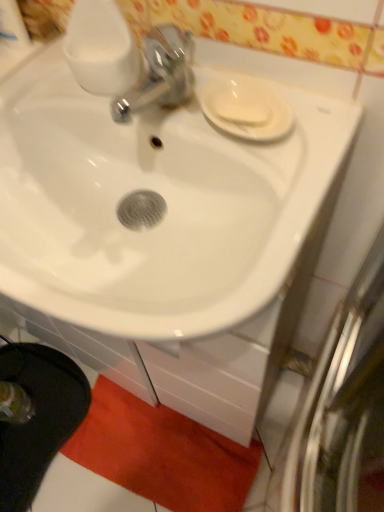
Find the location of a particular element. Image resolution: width=384 pixels, height=512 pixels. vacant space situated above orange plush bath mat at lower center (from a real-world perspective) is located at coordinates (164, 446).